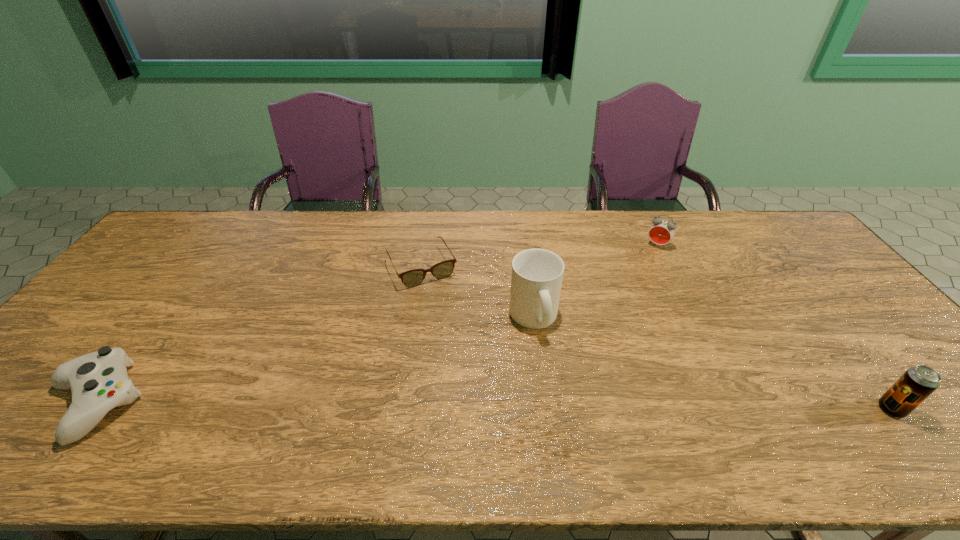
Where is `vacant space on the desktop that is between the leftmost object and the beer can and is positioned on the face of the second object from right to left`? The image size is (960, 540). vacant space on the desktop that is between the leftmost object and the beer can and is positioned on the face of the second object from right to left is located at coordinates (548, 406).

Find the location of a particular element. The width and height of the screenshot is (960, 540). free space on the desktop that is between the second shortest object and the rightmost object and is positioned at the front view of the shortest object is located at coordinates (496, 406).

This screenshot has width=960, height=540. Identify the location of vacant space on the desktop that is between the control and the beer can and is positioned on the handle side of the tallest object. coord(588,407).